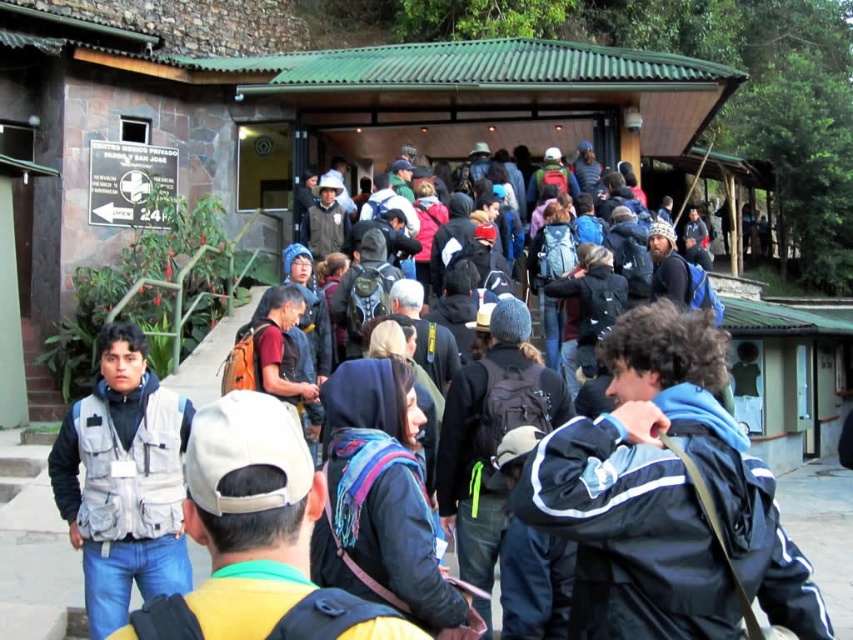
Question: Is gray fabric vest at center below blue fabric scarf at center?

Choices:
 (A) yes
 (B) no

Answer: (B)

Question: Estimate the real-world distances between objects in this image. Which object is farther from the blue fabric scarf at center?

Choices:
 (A) gray fabric vest at center
 (B) dark blue backpack at center

Answer: (A)

Question: Considering the relative positions of blue fabric jacket at center and blue fabric scarf at center in the image provided, where is blue fabric jacket at center located with respect to blue fabric scarf at center?

Choices:
 (A) right
 (B) left

Answer: (A)

Question: Which object is farther from the camera taking this photo?

Choices:
 (A) blue fabric jacket at center
 (B) gray fabric vest at center
 (C) dark blue backpack at center
 (D) blue fabric scarf at center

Answer: (C)

Question: Is blue fabric jacket at center to the right of dark blue backpack at center from the viewer's perspective?

Choices:
 (A) yes
 (B) no

Answer: (A)

Question: Which object is positioned closest to the blue fabric scarf at center?

Choices:
 (A) dark blue backpack at center
 (B) gray fabric vest at center
 (C) blue fabric jacket at center

Answer: (A)